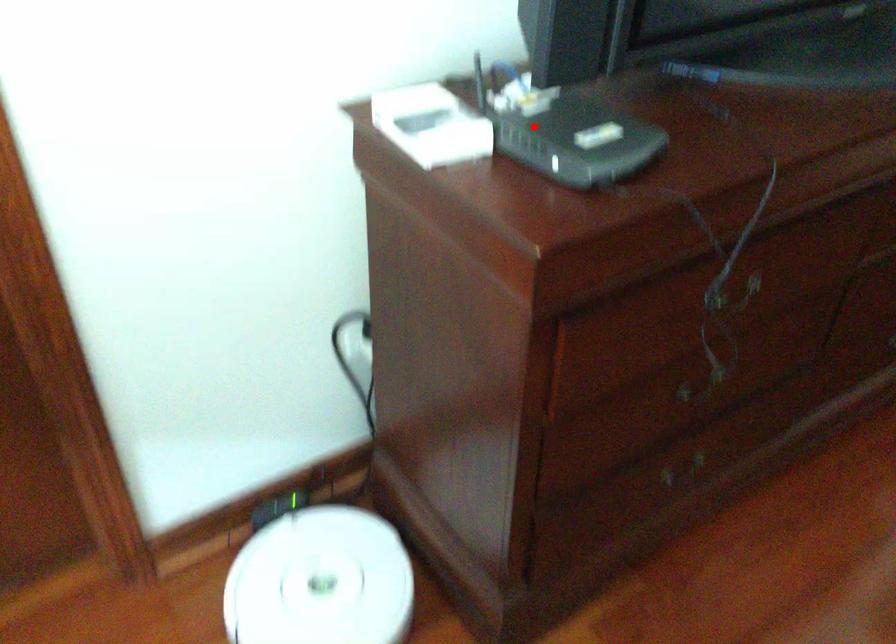
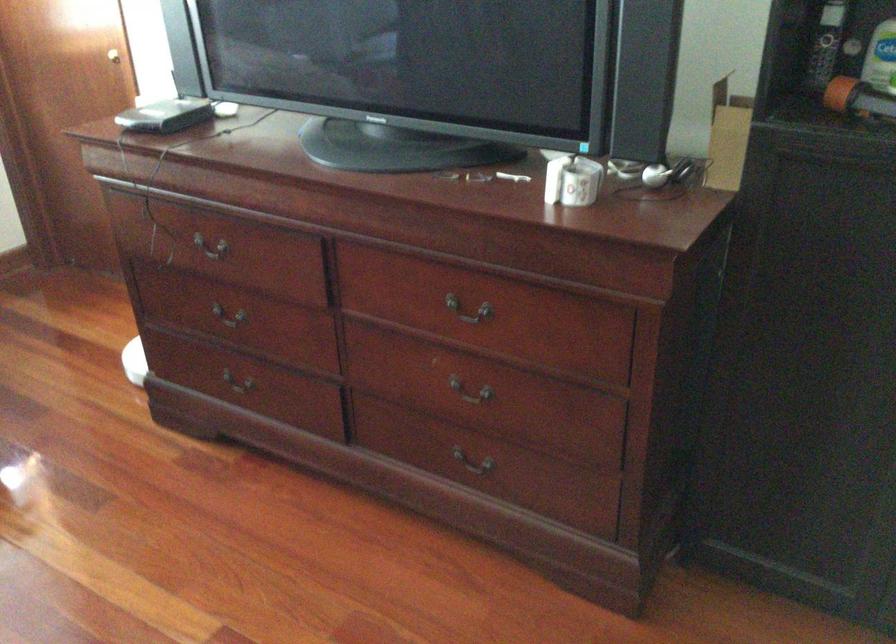
In the second image, find the point that corresponds to the highlighted location in the first image.

(165, 116)